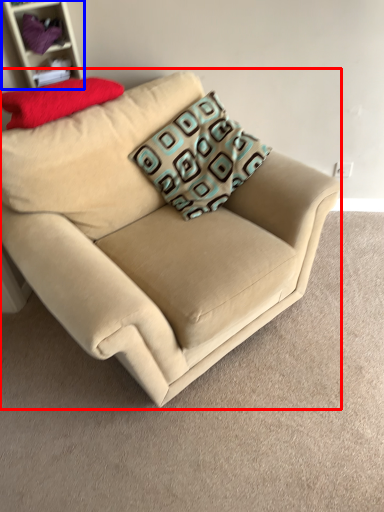
Question: Which of the following is the farthest to the observer, studio couch (highlighted by a red box) or shelf (highlighted by a blue box)?

Choices:
 (A) studio couch
 (B) shelf

Answer: (B)